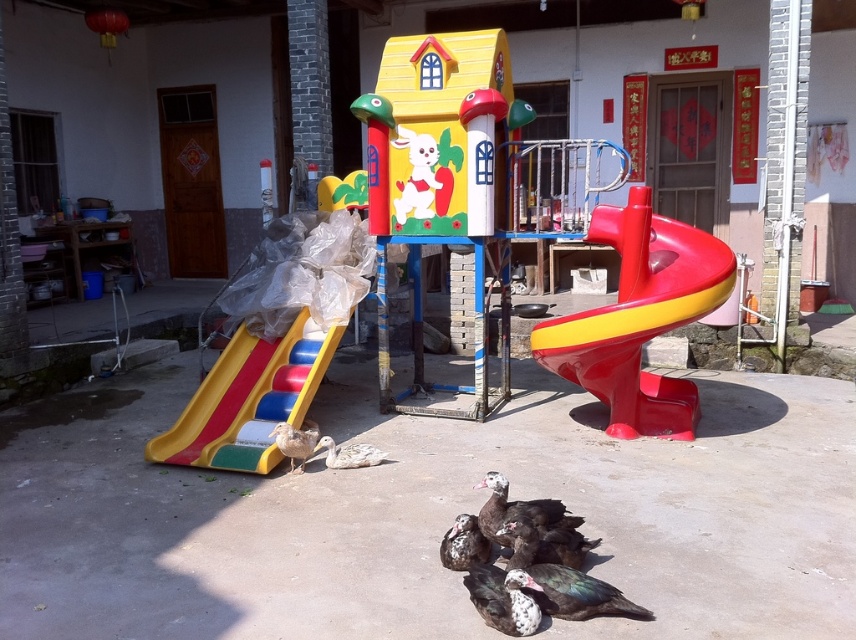
Is dark brown feathers at center wider than brown feathered duck at lower left?

Correct, the width of dark brown feathers at center exceeds that of brown feathered duck at lower left.

Which is more to the left, dark brown feathers at center or brown feathered duck at lower left?

brown feathered duck at lower left is more to the left.

Find the location of a particular element. dark brown feathers at center is located at coordinates (516, 509).

Who is lower down, shiny plastic slide at right or dark brown feathers at center?

Positioned lower is dark brown feathers at center.

Between shiny plastic slide at right and dark brown feathers at center, which one has more height?

With more height is shiny plastic slide at right.

What do you see at coordinates (639, 317) in the screenshot?
I see `shiny plastic slide at right` at bounding box center [639, 317].

Where is `shiny plastic slide at right`? The height and width of the screenshot is (640, 856). shiny plastic slide at right is located at coordinates (639, 317).

Between multicolored plastic slide at lower left and speckled feathered duckling at center, which one has more height?

multicolored plastic slide at lower left

Can you confirm if multicolored plastic slide at lower left is shorter than speckled feathered duckling at center?

In fact, multicolored plastic slide at lower left may be taller than speckled feathered duckling at center.

This screenshot has width=856, height=640. I want to click on multicolored plastic slide at lower left, so click(x=248, y=400).